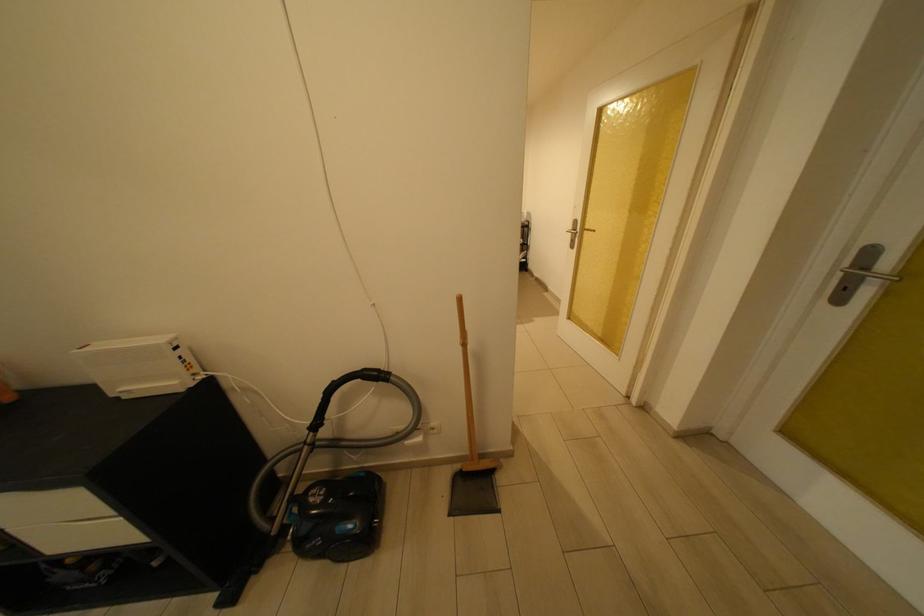
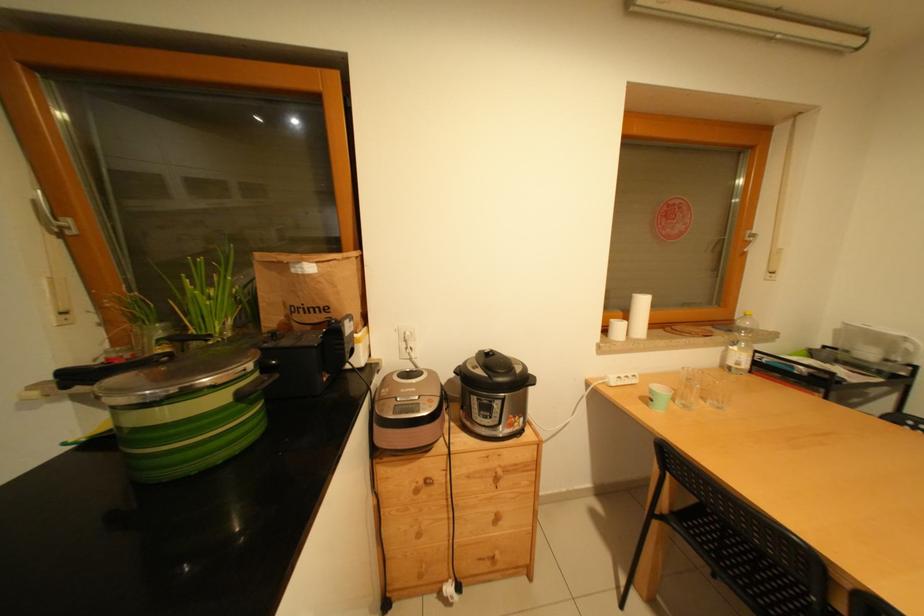
What movement of the cameraman would produce the second image?

The cameraman moved toward left, forward.